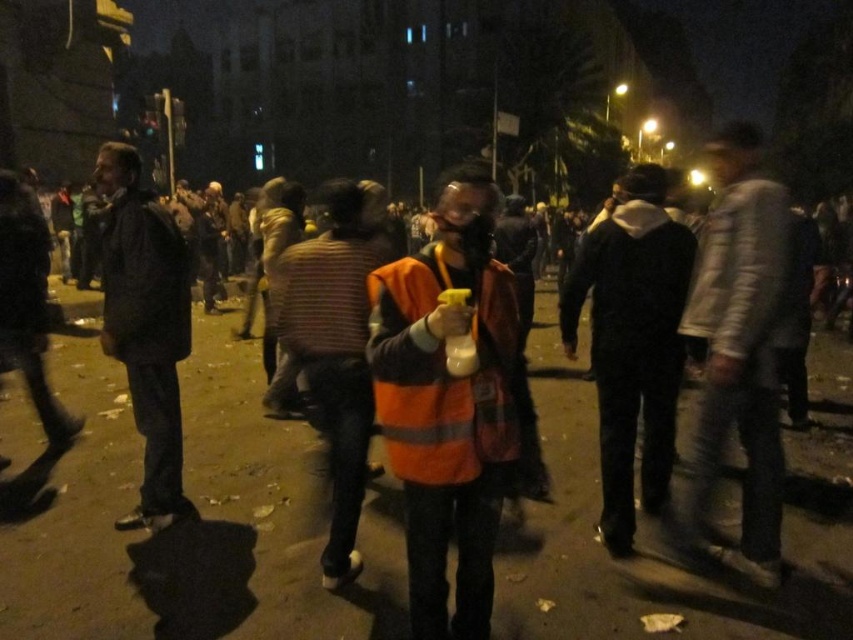
Question: Which of the following is the closest to the observer?

Choices:
 (A) (125, 358)
 (B) (396, 468)
 (C) (670, 465)
 (D) (776, 545)

Answer: (B)

Question: Is reflective orange vest at center to the right of dark matte jacket at left from the viewer's perspective?

Choices:
 (A) no
 (B) yes

Answer: (B)

Question: Which of the following is the closest to the observer?

Choices:
 (A) black matte jacket at center
 (B) reflective orange vest at center
 (C) orange reflective safety vest at center

Answer: (B)

Question: Can you confirm if reflective orange vest at center is positioned to the right of black matte jacket at center?

Choices:
 (A) yes
 (B) no

Answer: (B)

Question: Observing the image, what is the correct spatial positioning of reflective orange vest at center in reference to black matte jacket at center?

Choices:
 (A) below
 (B) above

Answer: (A)

Question: Among these points, which one is farthest from the camera?

Choices:
 (A) (491, 269)
 (B) (155, 337)

Answer: (B)